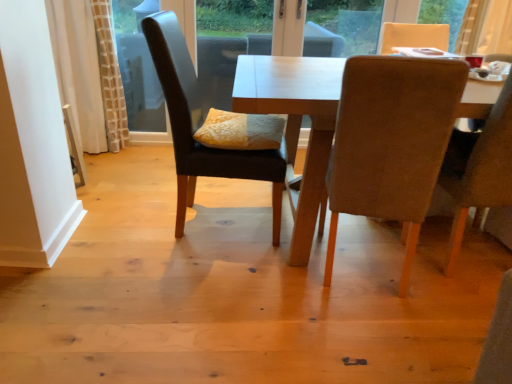
Locate an element on the screen. free space in front of dark brown leather chair at center, which is counted as the 1th chair, starting from the left is located at coordinates (247, 283).